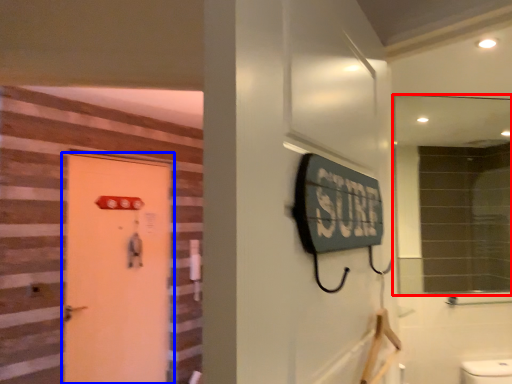
Question: Among these objects, which one is farthest to the camera, mirror (highlighted by a red box) or door (highlighted by a blue box)?

Choices:
 (A) mirror
 (B) door

Answer: (B)